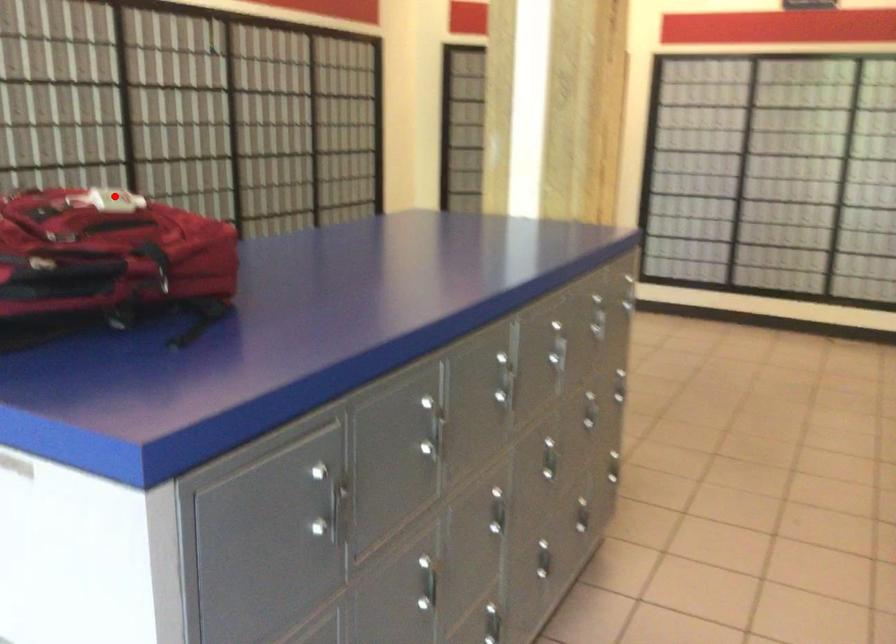
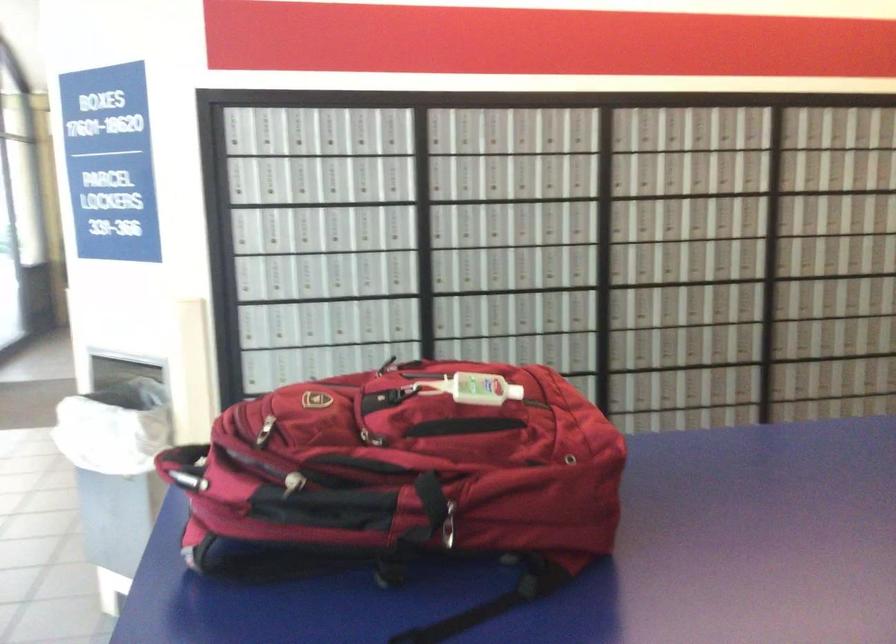
Where in the second image is the point corresponding to the highlighted location from the first image?

(471, 389)